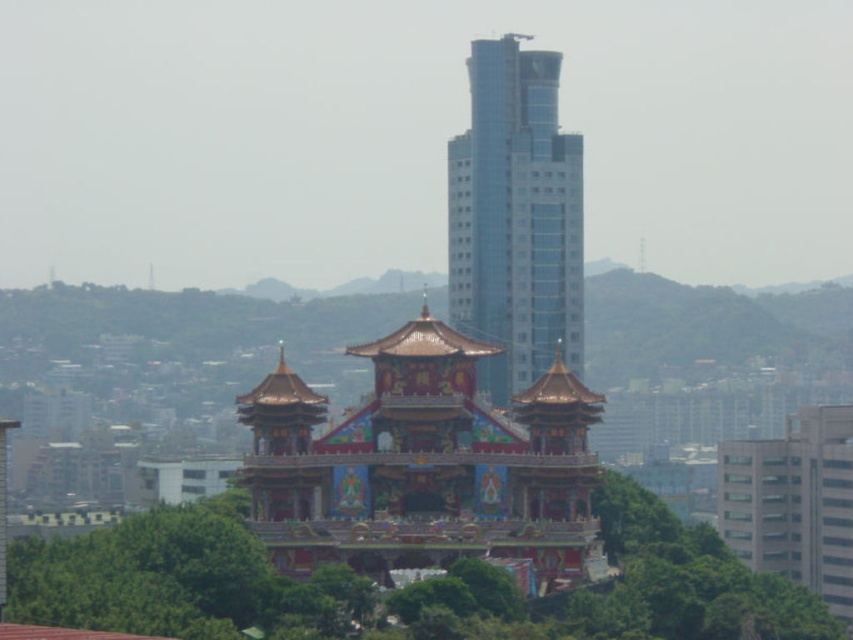
Question: Is gilded ornate pagoda at center to the left of green leafy tree at center from the viewer's perspective?

Choices:
 (A) no
 (B) yes

Answer: (A)

Question: Which point appears closest to the camera in this image?

Choices:
 (A) [252, 604]
 (B) [378, 576]

Answer: (A)

Question: Considering the real-world distances, which object is closest to the green leafy tree at center?

Choices:
 (A) gilded ornate pagoda at center
 (B) glassy blue skyscraper at center

Answer: (A)

Question: Can you confirm if gilded ornate pagoda at center is positioned above green leafy tree at center?

Choices:
 (A) no
 (B) yes

Answer: (B)

Question: Does gilded ornate pagoda at center have a smaller size compared to green leafy tree at center?

Choices:
 (A) no
 (B) yes

Answer: (B)

Question: Which point is farther from the camera taking this photo?

Choices:
 (A) click(544, 202)
 (B) click(815, 602)

Answer: (A)